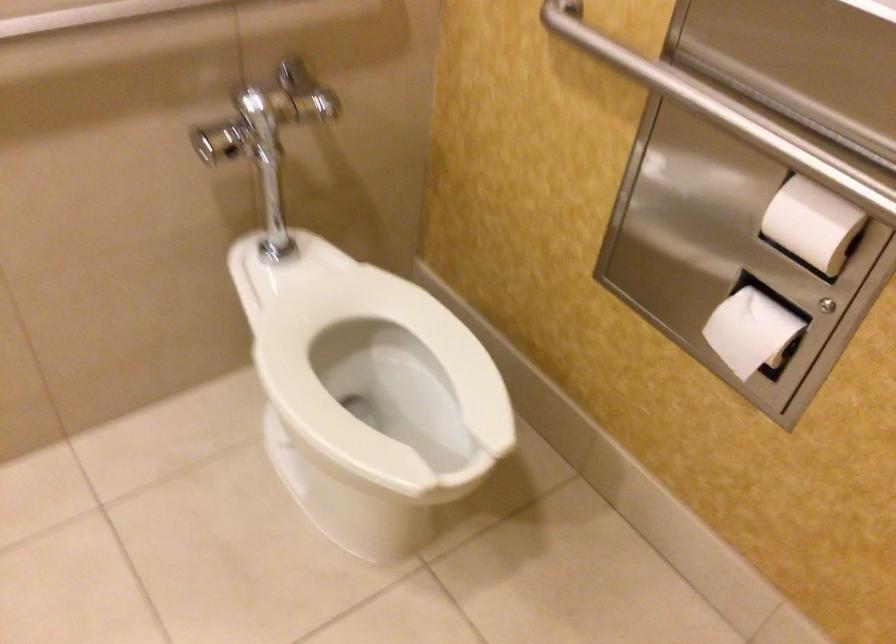
Describe the element at coordinates (217, 140) in the screenshot. I see `a toilet flush handle` at that location.